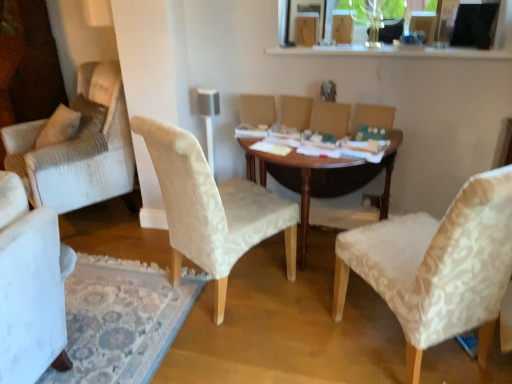
Question: Should I look upward or downward to see wooden table at center?

Choices:
 (A) up
 (B) down

Answer: (B)

Question: Is white textured chair at right, acting as the second chair starting from the left, oriented towards white textured chair at center, which is counted as the first chair, starting from the left?

Choices:
 (A) yes
 (B) no

Answer: (B)

Question: Would you say white textured chair at right, marked as the 1th chair in a right-to-left arrangement, is outside white textured chair at center, which is the 2th chair from right to left?

Choices:
 (A) yes
 (B) no

Answer: (A)

Question: From a real-world perspective, is white textured chair at right, acting as the second chair starting from the left, located higher than white textured chair at center, which is counted as the first chair, starting from the left?

Choices:
 (A) no
 (B) yes

Answer: (B)

Question: Can you confirm if white textured chair at right, marked as the 1th chair in a right-to-left arrangement, is taller than white textured chair at center, which is the 2th chair from right to left?

Choices:
 (A) no
 (B) yes

Answer: (B)

Question: Is white textured chair at right, marked as the 1th chair in a right-to-left arrangement, shorter than white textured chair at center, which is counted as the first chair, starting from the left?

Choices:
 (A) no
 (B) yes

Answer: (A)

Question: From the image's perspective, is white textured chair at right, acting as the second chair starting from the left, under white textured chair at center, which is the 2th chair from right to left?

Choices:
 (A) yes
 (B) no

Answer: (A)

Question: Is beige fabric armchair at center, marked as the 1th armchair in a right-to-left arrangement, positioned with its back to white textured chair at right, acting as the second chair starting from the left?

Choices:
 (A) yes
 (B) no

Answer: (B)

Question: Is beige fabric armchair at center, which is counted as the second armchair, starting from the left, at the right side of white textured chair at right, marked as the 1th chair in a right-to-left arrangement?

Choices:
 (A) yes
 (B) no

Answer: (B)

Question: Is beige fabric armchair at center, marked as the 1th armchair in a right-to-left arrangement, to the left of white textured chair at right, marked as the 1th chair in a right-to-left arrangement, from the viewer's perspective?

Choices:
 (A) yes
 (B) no

Answer: (A)

Question: Is beige fabric armchair at center, which is counted as the second armchair, starting from the left, next to white textured chair at right, marked as the 1th chair in a right-to-left arrangement?

Choices:
 (A) yes
 (B) no

Answer: (B)

Question: Can you confirm if beige fabric armchair at center, marked as the 1th armchair in a right-to-left arrangement, is taller than white textured chair at right, acting as the second chair starting from the left?

Choices:
 (A) yes
 (B) no

Answer: (B)

Question: From a real-world perspective, is beige fabric armchair at center, which is counted as the second armchair, starting from the left, beneath white textured chair at right, marked as the 1th chair in a right-to-left arrangement?

Choices:
 (A) no
 (B) yes

Answer: (A)

Question: Is wooden table at center in front of white textured chair at center, which is the 2th chair from right to left?

Choices:
 (A) no
 (B) yes

Answer: (A)